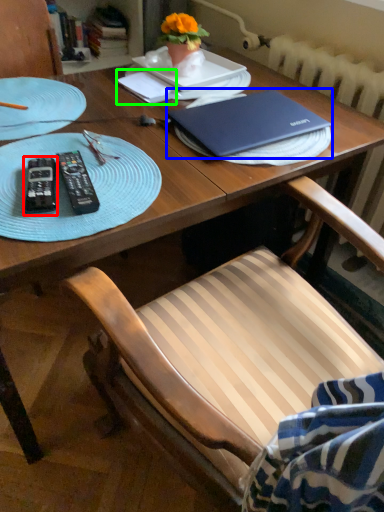
Question: Based on their relative distances, which object is farther from remote control (highlighted by a red box)? Choose from laptop (highlighted by a blue box) and notepad (highlighted by a green box).

Choices:
 (A) laptop
 (B) notepad

Answer: (B)